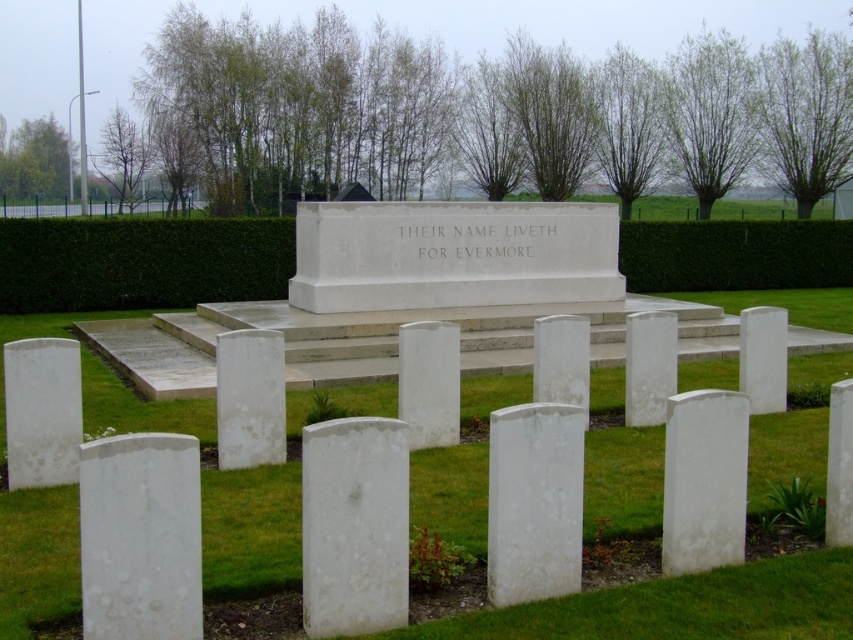
Between green grass at center and green hedge at upper center, which one has more height?

green grass at center

Who is more distant from viewer, (244, 500) or (706, 253)?

Point (706, 253)

I want to click on green grass at center, so click(683, 608).

Identify the location of green grass at center. (683, 608).

Where is `green grass at center`? green grass at center is located at coordinates (683, 608).

You are a GUI agent. You are given a task and a screenshot of the screen. Output one action in this format:
    pyautogui.click(x=<x>, y=<y>)
    Task: Click on the green grass at center
    
    Given the screenshot: What is the action you would take?
    click(x=683, y=608)

Who is lower down, green leafy hedge at center or green hedge at upper center?

green leafy hedge at center

Does green leafy hedge at center have a lesser height compared to green hedge at upper center?

In fact, green leafy hedge at center may be taller than green hedge at upper center.

Which is behind, point (94, 298) or point (689, 243)?

The point (689, 243) is behind.

You are a GUI agent. You are given a task and a screenshot of the screen. Output one action in this format:
    pyautogui.click(x=<x>, y=<y>)
    Task: Click on the green leafy hedge at center
    
    Given the screenshot: What is the action you would take?
    (140, 262)